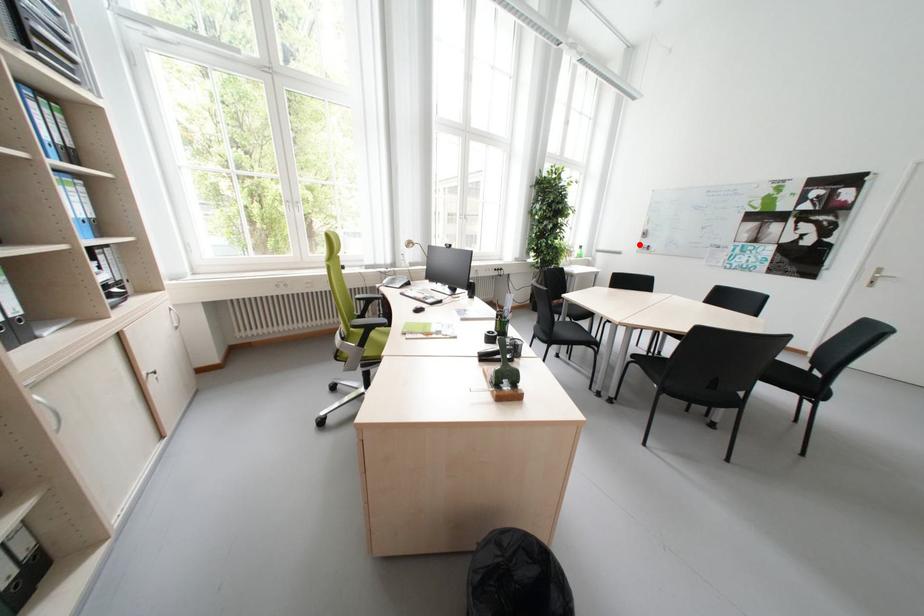
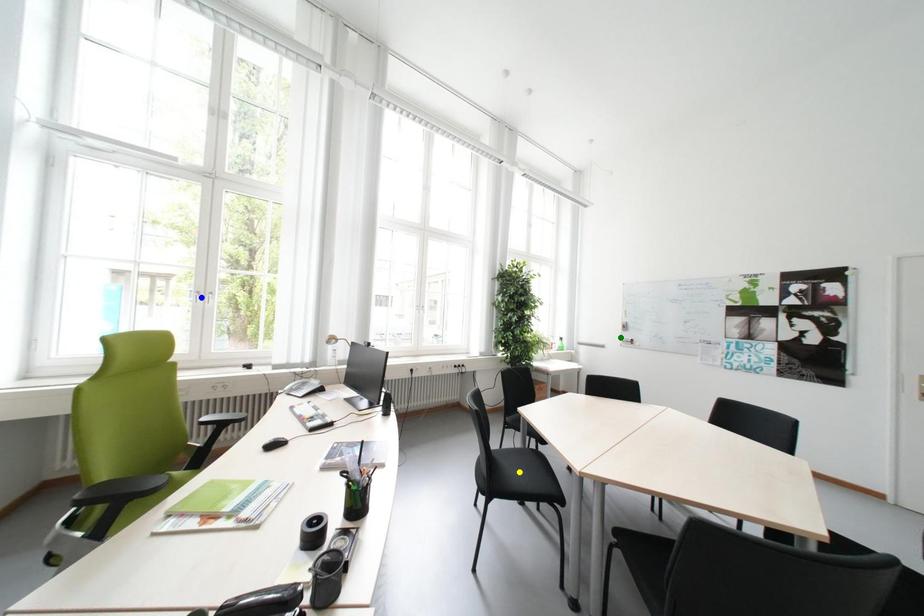
Question: I am providing you with two images of the same scene from different viewpoints. A red point is marked on the first image. You are given multiple points on the second image. Can you choose the point in image 2 that corresponds to the point in image 1?

Choices:
 (A) yellow point
 (B) green point
 (C) blue point

Answer: (B)